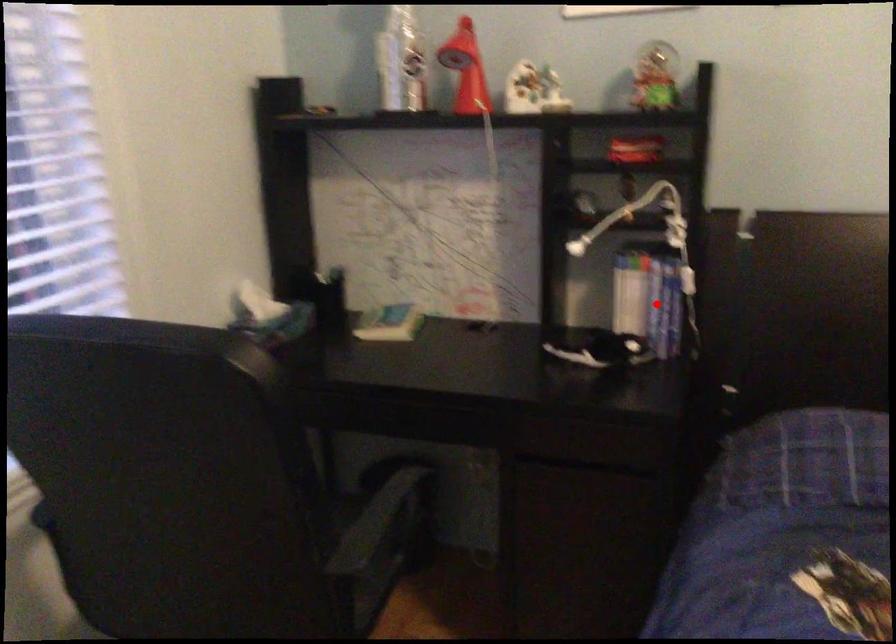
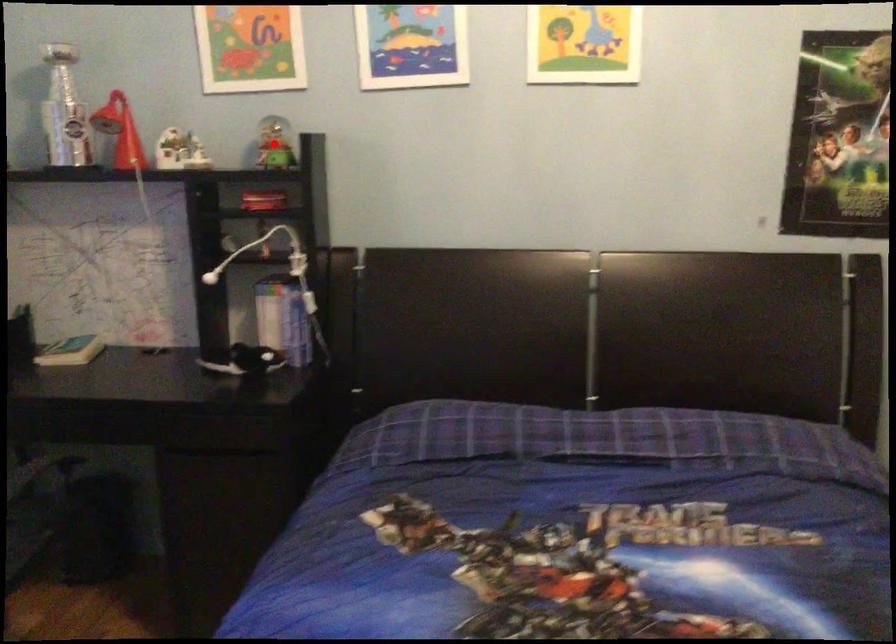
I am providing you with two images of the same scene from different viewpoints. A red point is marked on the first image and another point is marked on the second image. Are the points marked in image1 and image2 representing the same 3D position?

No